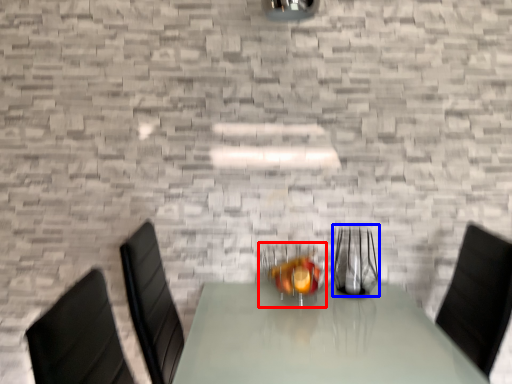
Question: Which object appears closest to the camera in this image, tableware (highlighted by a red box) or tableware (highlighted by a blue box)?

Choices:
 (A) tableware
 (B) tableware

Answer: (A)